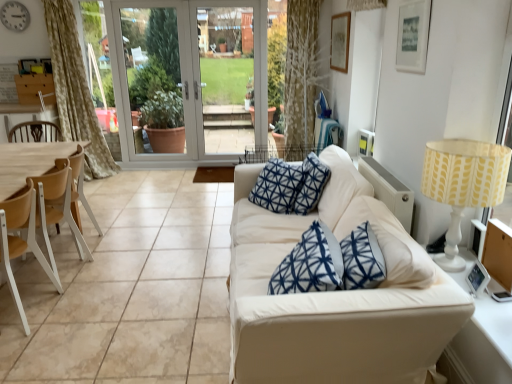
The width and height of the screenshot is (512, 384). I want to click on empty space that is to the right of light wood/woodenchair at left, arranged as the 2th chair when viewed from the front, so click(116, 246).